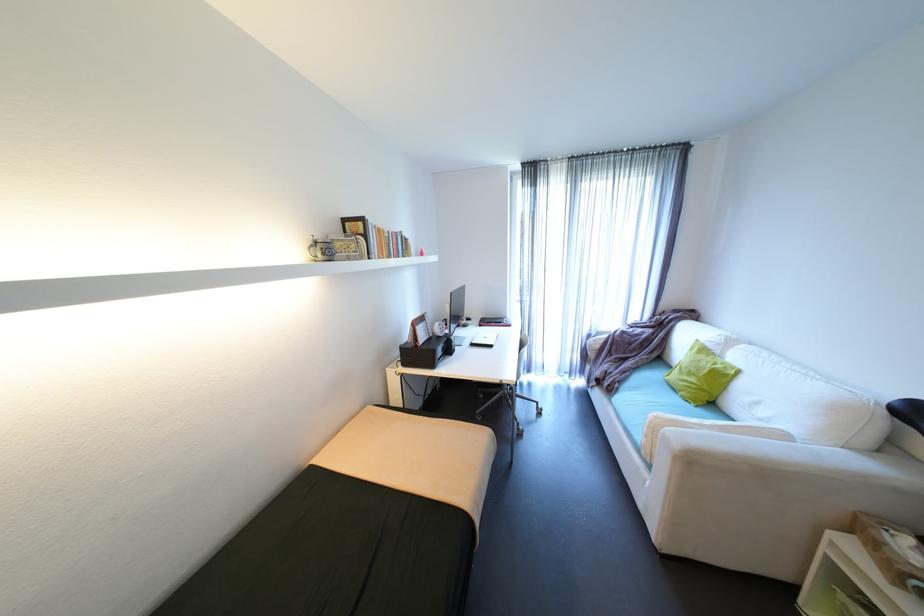
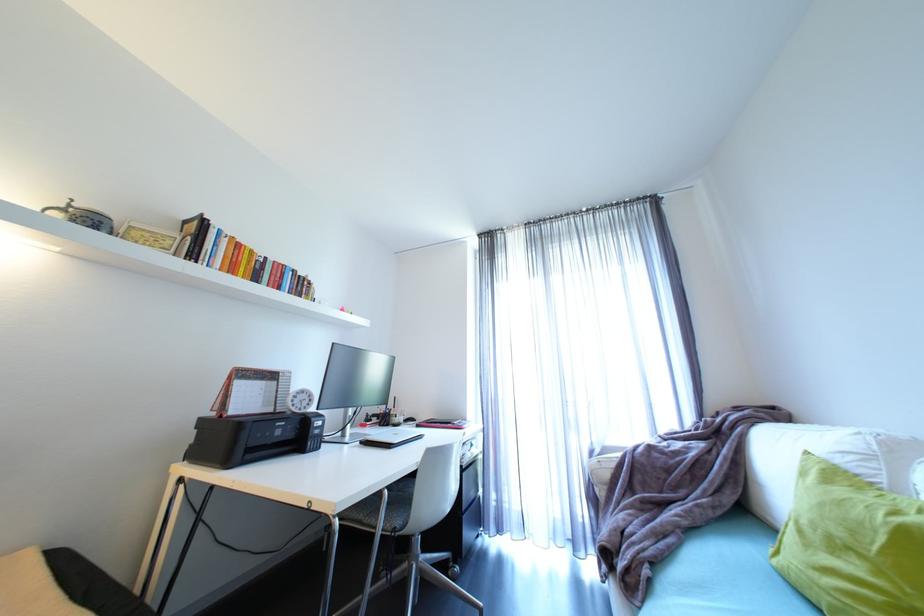
Find the pixel in the second image that matches the point at 423,346 in the first image.

(228, 416)